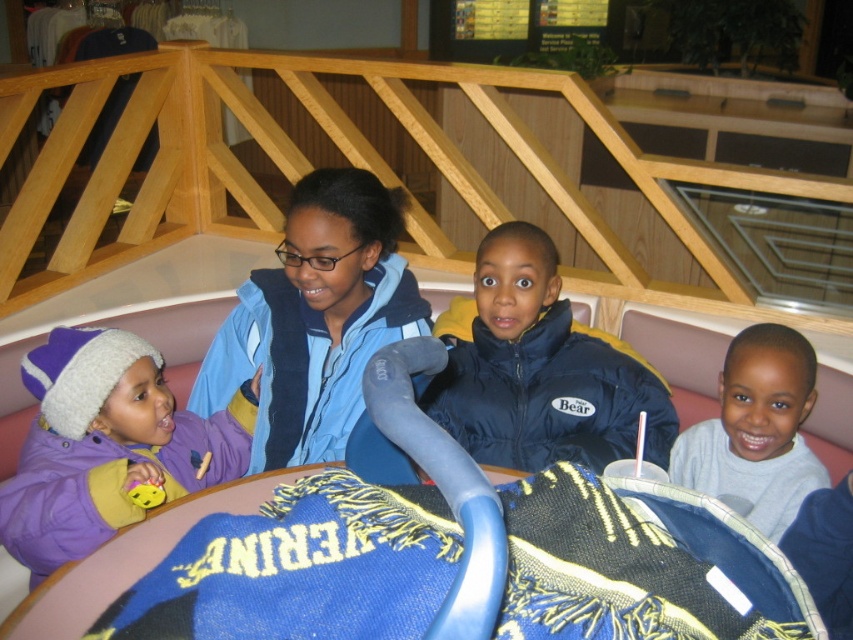
Does navy blue puffer jacket at center appear under purple fleece jacket at left?

No.

Locate an element on the screen. The height and width of the screenshot is (640, 853). navy blue puffer jacket at center is located at coordinates (538, 369).

Is point (154, 422) less distant than point (810, 451)?

Yes, point (154, 422) is closer to viewer.

Is point (154, 449) positioned in front of point (701, 474)?

Yes.

I want to click on purple fleece jacket at left, so click(x=107, y=444).

Does navy blue puffer jacket at center have a lesser width compared to gray cotton shirt at lower right?

Incorrect, navy blue puffer jacket at center's width is not less than gray cotton shirt at lower right's.

Is navy blue puffer jacket at center positioned in front of gray cotton shirt at lower right?

That is False.

Locate an element on the screen. The height and width of the screenshot is (640, 853). navy blue puffer jacket at center is located at coordinates (538, 369).